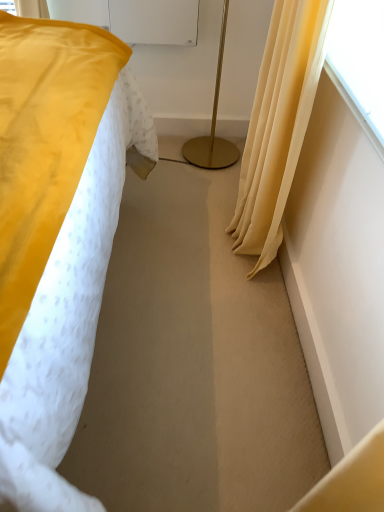
Question: Is transparent plastic screen at upper right wider or thinner than matte yellow curtain at right?

Choices:
 (A) thin
 (B) wide

Answer: (B)

Question: Is transparent plastic screen at upper right taller or shorter than matte yellow curtain at right?

Choices:
 (A) short
 (B) tall

Answer: (A)

Question: Which object is the farthest from the gold metallic floor lamp at center?

Choices:
 (A) transparent plastic screen at upper right
 (B) matte yellow curtain at right

Answer: (A)

Question: Which is nearer to the matte yellow curtain at right?

Choices:
 (A) gold metallic floor lamp at center
 (B) transparent plastic screen at upper right

Answer: (B)